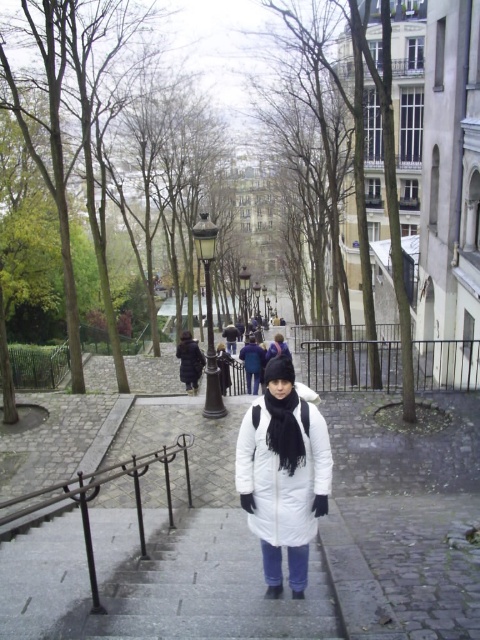
Looking at this image, you are standing at the base of the gray stone stairs at center in Montmartre. Your friend is waiting for you at the top of the stairs. If you start walking up the stairs at a pace of 2 feet per second, how many seconds will it take you to reach your friend?

The distance between you and the gray stone stairs at center is 12.81 feet. Since you are starting at the base of the stairs, the total distance to climb is 12.81 feet. At a pace of 2 feet per second, it will take 12.81 divided by 2, which is approximately 6.4 seconds to reach the top.

You are a tourist in Montmartre and want to take a photo of the dark brown leather coat at center and the black metal rail at right. Which object is wider in the image?

The black metal rail at right might be wider than dark brown leather coat at center.